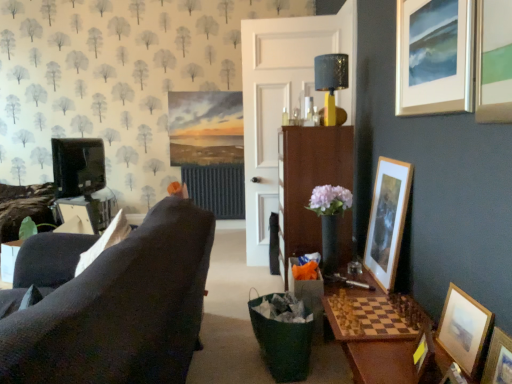
Question: Is white wooden door at center at the back of wooden picture frame at lower right, arranged as the 5th picture frame when viewed from the top?

Choices:
 (A) no
 (B) yes

Answer: (A)

Question: Is wooden picture frame at lower right, arranged as the 5th picture frame when viewed from the top, positioned far away from white wooden door at center?

Choices:
 (A) no
 (B) yes

Answer: (B)

Question: Can you confirm if wooden picture frame at lower right, marked as the 2th picture frame in a bottom-to-top arrangement, is smaller than white wooden door at center?

Choices:
 (A) no
 (B) yes

Answer: (B)

Question: Can you confirm if wooden picture frame at lower right, marked as the 2th picture frame in a bottom-to-top arrangement, is taller than white wooden door at center?

Choices:
 (A) no
 (B) yes

Answer: (A)

Question: From the image's perspective, is wooden picture frame at lower right, arranged as the 5th picture frame when viewed from the top, on white wooden door at center?

Choices:
 (A) yes
 (B) no

Answer: (B)

Question: In terms of height, does wooden framed picture at right, placed as the fifth picture frame when sorted from bottom to top, look taller or shorter compared to wooden picture frame at lower right, the 3th picture frame when ordered from bottom to top?

Choices:
 (A) short
 (B) tall

Answer: (B)

Question: Considering the positions of wooden framed picture at right, which ranks as the second picture frame in top-to-bottom order, and wooden picture frame at lower right, placed as the 4th picture frame when sorted from top to bottom, in the image, is wooden framed picture at right, which ranks as the second picture frame in top-to-bottom order, wider or thinner than wooden picture frame at lower right, placed as the 4th picture frame when sorted from top to bottom,?

Choices:
 (A) thin
 (B) wide

Answer: (A)

Question: From the image's perspective, relative to wooden picture frame at lower right, placed as the 4th picture frame when sorted from top to bottom, is wooden framed picture at right, which ranks as the second picture frame in top-to-bottom order, above or below?

Choices:
 (A) above
 (B) below

Answer: (A)

Question: Considering their positions, is wooden framed picture at right, which ranks as the second picture frame in top-to-bottom order, located in front of or behind wooden picture frame at lower right, the 3th picture frame when ordered from bottom to top?

Choices:
 (A) behind
 (B) front

Answer: (A)

Question: Considering the positions of point (483, 367) and point (457, 41), is point (483, 367) closer or farther from the camera than point (457, 41)?

Choices:
 (A) farther
 (B) closer

Answer: (B)

Question: Choose the correct answer: Is wooden picture frame at lower right, marked as the 2th picture frame in a bottom-to-top arrangement, inside silver metallic picture frame at upper right, arranged as the 6th picture frame when ordered from the bottom, or outside it?

Choices:
 (A) outside
 (B) inside

Answer: (A)

Question: Is wooden picture frame at lower right, marked as the 2th picture frame in a bottom-to-top arrangement, bigger or smaller than silver metallic picture frame at upper right, arranged as the 6th picture frame when ordered from the bottom?

Choices:
 (A) small
 (B) big

Answer: (A)

Question: From a real-world perspective, is wooden picture frame at lower right, marked as the 2th picture frame in a bottom-to-top arrangement, physically located above or below silver metallic picture frame at upper right, placed as the 1th picture frame when sorted from top to bottom?

Choices:
 (A) below
 (B) above

Answer: (A)

Question: Based on their sizes in the image, would you say shiny metallic lampshade at upper center is bigger or smaller than wooden picture frame at lower right, marked as the 2th picture frame in a bottom-to-top arrangement?

Choices:
 (A) big
 (B) small

Answer: (A)

Question: Is shiny metallic lampshade at upper center taller or shorter than wooden picture frame at lower right, marked as the 2th picture frame in a bottom-to-top arrangement?

Choices:
 (A) short
 (B) tall

Answer: (B)